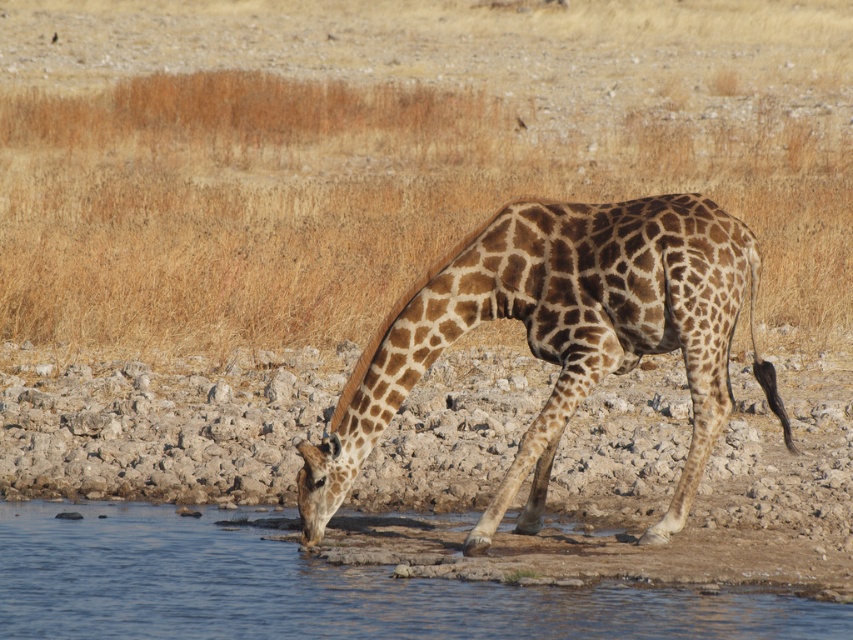
Question: Does brown dry grass at center have a lesser width compared to clear water at lower left?

Choices:
 (A) yes
 (B) no

Answer: (B)

Question: Which of the following is the farthest from the observer?

Choices:
 (A) brown dry grass at center
 (B) clear water at lower left

Answer: (A)

Question: Does spotted fur giraffe at center have a smaller size compared to clear water at lower left?

Choices:
 (A) yes
 (B) no

Answer: (B)

Question: Which object is the closest to the clear water at lower left?

Choices:
 (A) spotted fur giraffe at center
 (B) brown dry grass at center

Answer: (A)

Question: Which object is the closest to the brown dry grass at center?

Choices:
 (A) spotted fur giraffe at center
 (B) clear water at lower left

Answer: (A)

Question: Does spotted fur giraffe at center appear on the left side of clear water at lower left?

Choices:
 (A) no
 (B) yes

Answer: (A)